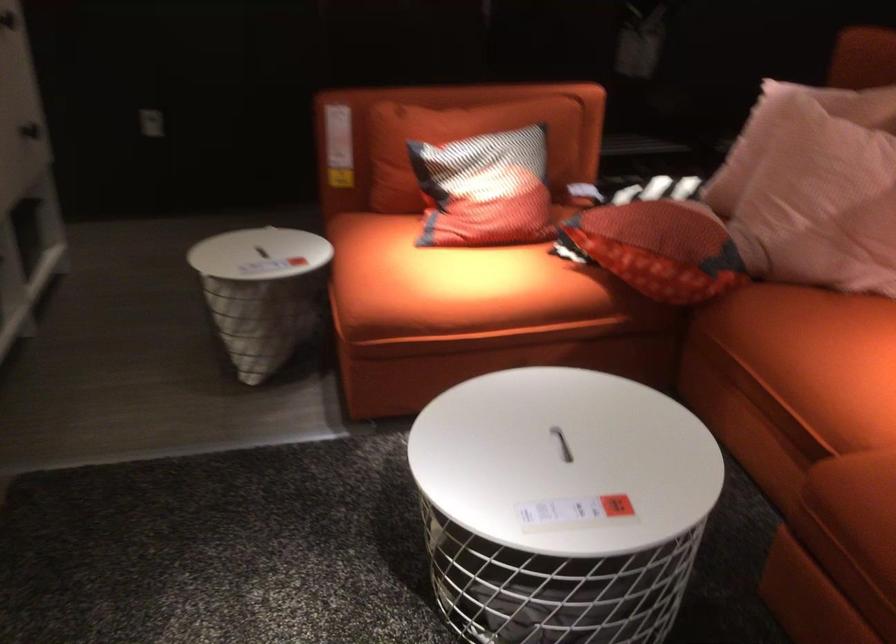
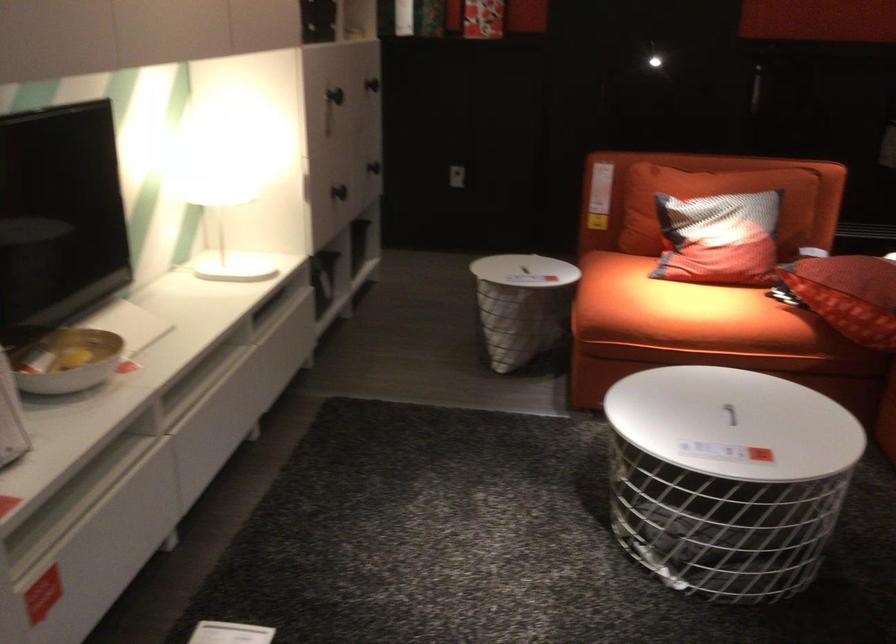
Locate, in the second image, the point that corresponds to (x=480, y=196) in the first image.

(719, 239)